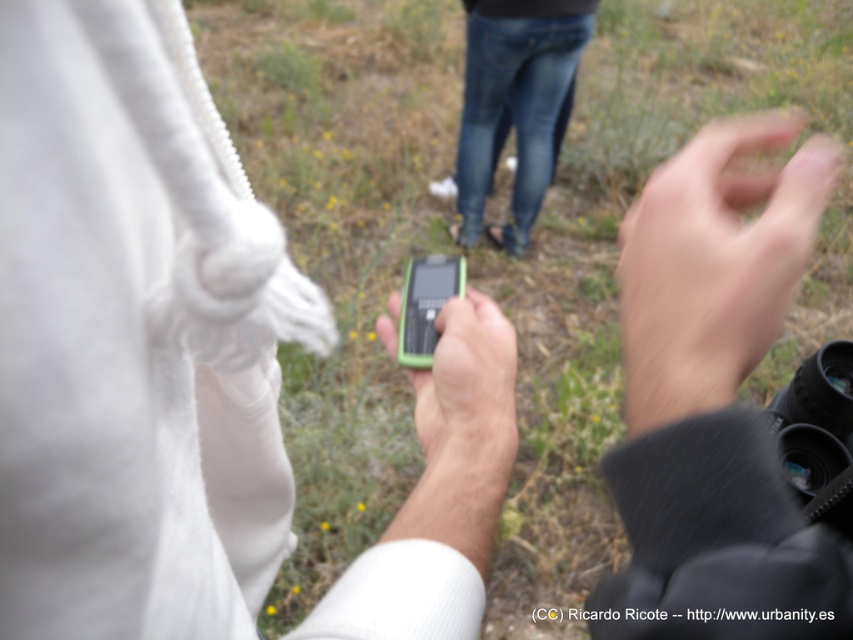
Is green plastic phone at center wider than green matte smartphone at center?

Correct, the width of green plastic phone at center exceeds that of green matte smartphone at center.

Describe the element at coordinates (134, 336) in the screenshot. This screenshot has width=853, height=640. I see `green plastic phone at center` at that location.

Is point (169, 188) less distant than point (407, 340)?

Yes, point (169, 188) is closer to viewer.

Where is `green plastic phone at center`? green plastic phone at center is located at coordinates (134, 336).

Does point (811, 179) come farther from viewer compared to point (440, 305)?

No, (811, 179) is closer to viewer.

Locate an element on the screen. The height and width of the screenshot is (640, 853). skinny flesh-toned hand at center is located at coordinates (714, 262).

Does point (421, 476) come closer to viewer compared to point (430, 268)?

That is False.

Does green matte phone at center lie behind green matte smartphone at center?

No, it is not.

Find the location of `green matte phone at center`. green matte phone at center is located at coordinates (468, 396).